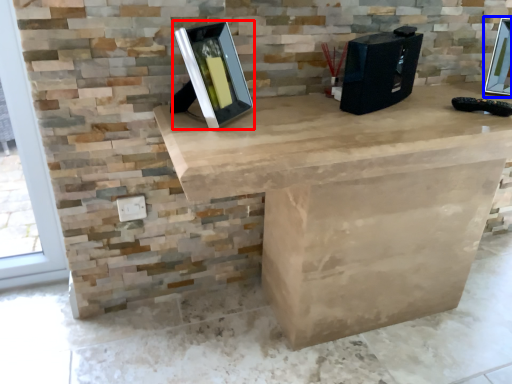
Question: Which object is closer to the camera taking this photo, picture frame (highlighted by a red box) or picture frame (highlighted by a blue box)?

Choices:
 (A) picture frame
 (B) picture frame

Answer: (A)